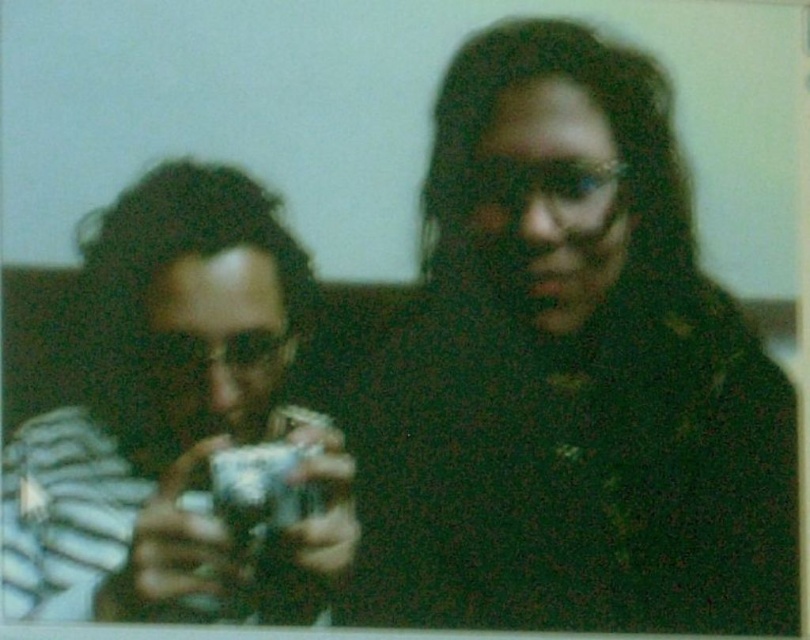
Who is more distant from viewer, (x=608, y=248) or (x=152, y=490)?

Positioned behind is point (x=608, y=248).

Between point (435, 554) and point (146, 208), which one is positioned in front?

Point (146, 208)

Where is `black matte sweater at center`? black matte sweater at center is located at coordinates (568, 376).